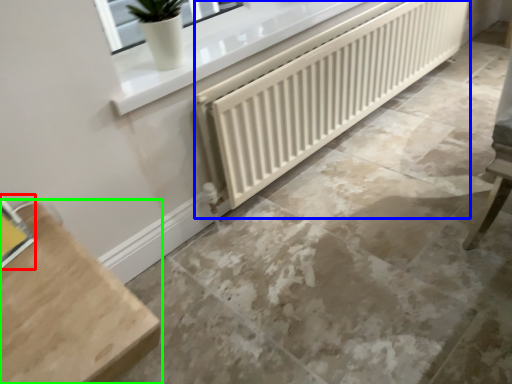
Question: Which object is positioned closest to window (highlighted by a red box)? Select from radiator (highlighted by a blue box) and furniture (highlighted by a green box).

Choices:
 (A) radiator
 (B) furniture

Answer: (B)